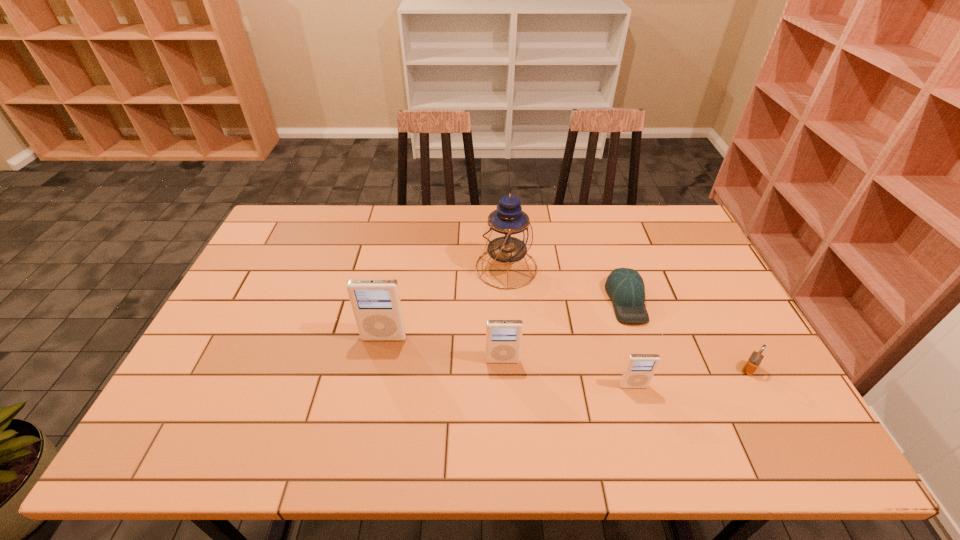
Locate an element on the screen. The image size is (960, 540). vacant region that satisfies the following two spatial constraints: 1. on the front-facing side of the lantern; 2. on the left side of the rightmost object is located at coordinates (513, 369).

Image resolution: width=960 pixels, height=540 pixels. In order to click on free space that satisfies the following two spatial constraints: 1. on the front-facing side of the tallest object; 2. on the left side of the rightmost object in this screenshot , I will do `click(513, 369)`.

The image size is (960, 540). In order to click on free space in the image that satisfies the following two spatial constraints: 1. on the front-facing side of the tallest object; 2. on the left side of the shortest object in this screenshot , I will do `click(508, 300)`.

Where is `free space that satisfies the following two spatial constraints: 1. on the front-facing side of the tallest object; 2. on the left side of the shortest object`? free space that satisfies the following two spatial constraints: 1. on the front-facing side of the tallest object; 2. on the left side of the shortest object is located at coordinates (508, 300).

This screenshot has height=540, width=960. What are the coordinates of `vacant point that satisfies the following two spatial constraints: 1. on the front-facing side of the padlock; 2. on the left side of the second iPod from left to right` in the screenshot? It's located at (503, 369).

You are a GUI agent. You are given a task and a screenshot of the screen. Output one action in this format:
    pyautogui.click(x=<x>, y=<y>)
    Task: Click on the vacant position in the image that satisfies the following two spatial constraints: 1. on the front-facing side of the tallest object; 2. on the front-facing side of the second nearest iPod
    The width and height of the screenshot is (960, 540).
    Given the screenshot: What is the action you would take?
    pyautogui.click(x=512, y=361)